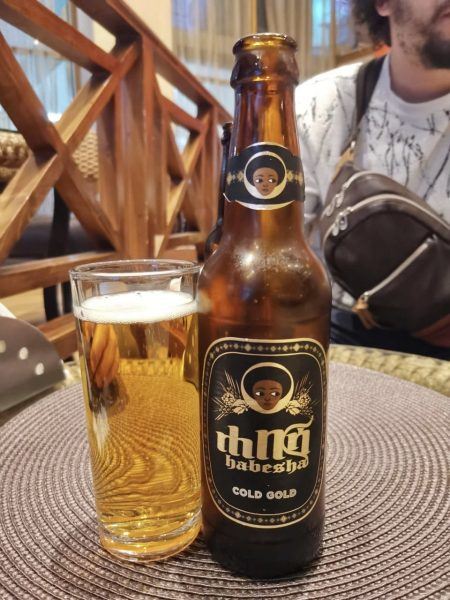
Identify the location of drapes. (212, 19), (287, 27), (42, 75).